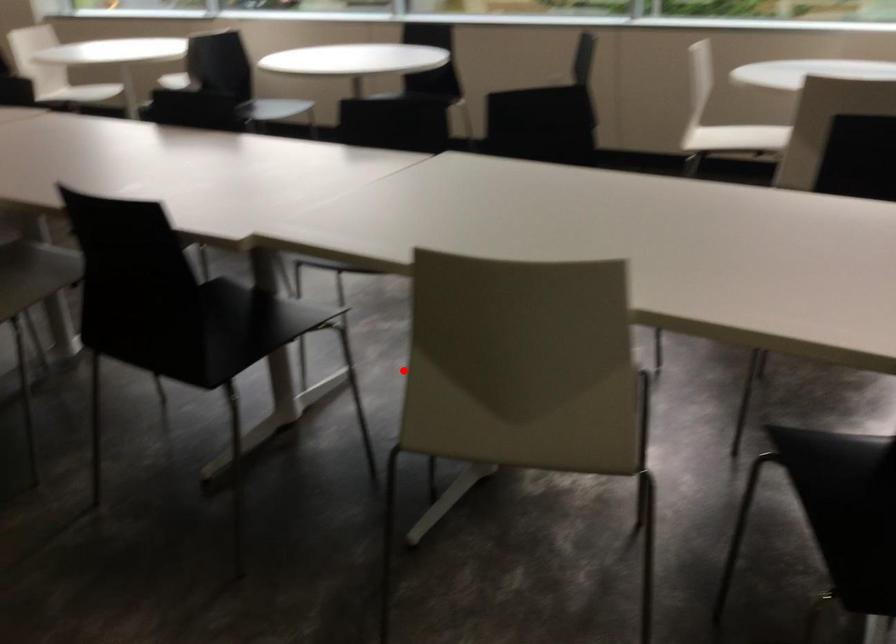
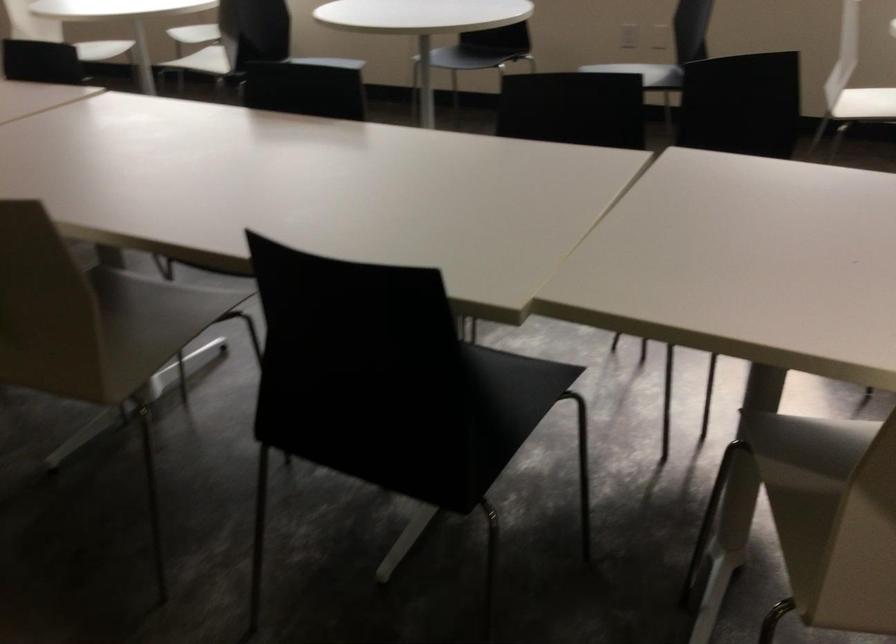
Locate, in the second image, the point that corresponds to the highlighted location in the first image.

(831, 516)